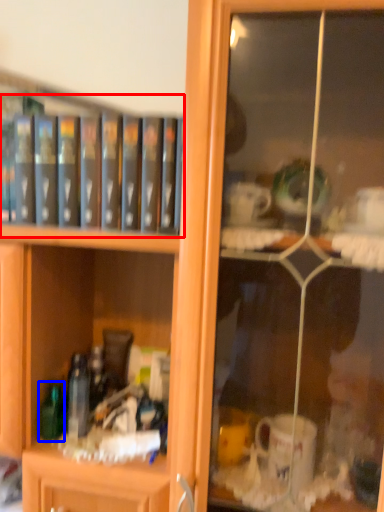
Question: Which of the following is the farthest to the observer, book (highlighted by a red box) or bottle (highlighted by a blue box)?

Choices:
 (A) book
 (B) bottle

Answer: (B)